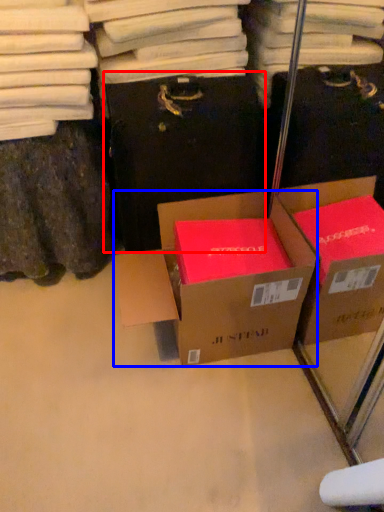
Question: Which of the following is the farthest to the observer, cardboard box (highlighted by a red box) or box (highlighted by a blue box)?

Choices:
 (A) cardboard box
 (B) box

Answer: (A)